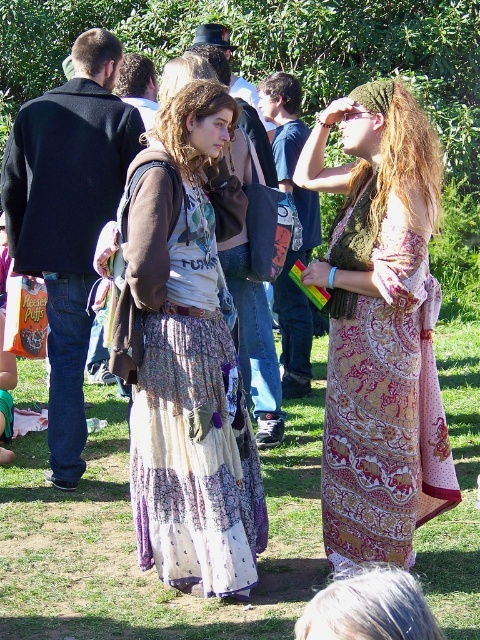
Question: Which of the following is the closest to the observer?

Choices:
 (A) printed cotton skirt at center
 (B) boho-patterned skirt at center
 (C) green grass at lower center
 (D) patterned fabric dress at center

Answer: (B)

Question: Which object is the closest to the green grass at lower center?

Choices:
 (A) printed cotton skirt at center
 (B) boho-patterned skirt at center
 (C) patterned fabric dress at center

Answer: (A)

Question: Is printed cotton skirt at center positioned in front of boho-patterned skirt at center?

Choices:
 (A) no
 (B) yes

Answer: (A)

Question: Is green grass at lower center below patterned fabric dress at center?

Choices:
 (A) yes
 (B) no

Answer: (A)

Question: Based on their relative distances, which object is farther from the patterned fabric dress at center?

Choices:
 (A) boho-patterned skirt at center
 (B) green grass at lower center
 (C) printed cotton skirt at center

Answer: (A)

Question: Is green grass at lower center wider than printed cotton skirt at center?

Choices:
 (A) no
 (B) yes

Answer: (B)